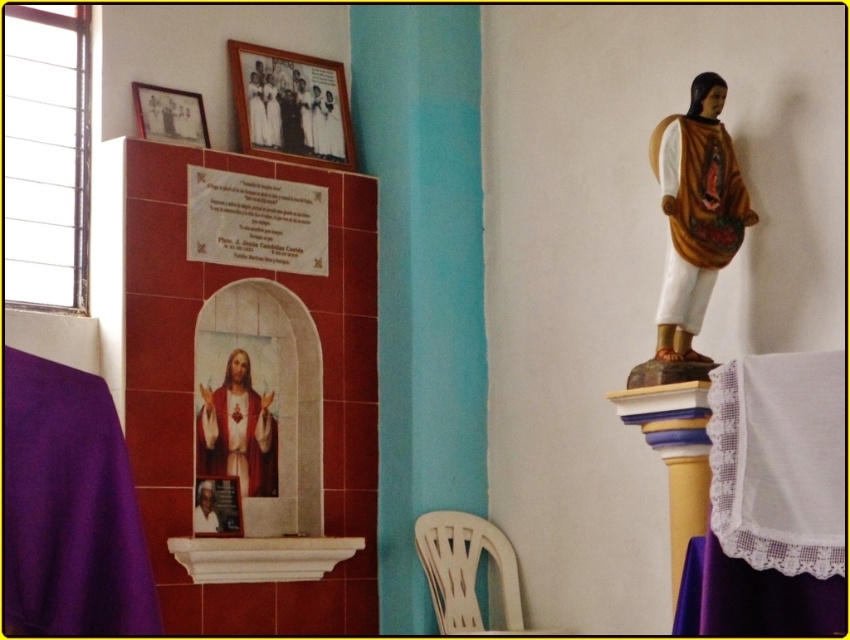
You are an interior designer planning to install a new light fixture in this space. You need to decide whether the matte brown statue at upper right and the matte black photo frame at upper center will block the light from reaching the center area. Based on their positions, can you determine which object is closer to the front and might cast a larger shadow?

The matte brown statue at upper right is in front of the matte black photo frame at upper center, so it is closer to the front and would cast a larger shadow over the center area.

You are an interior designer planning to add a new decorative element to this religious space. You have a small golden ornament that is 10 cm in height. You want to place it near the smooth white statue at upper right and the white matte robe at upper center. Considering their sizes, which object should you place it closer to if you want the ornament to appear proportionally balanced?

The smooth white statue at upper right has a smaller size compared to the white matte robe at upper center. To achieve proportional balance, the small golden ornament of 10 cm should be placed closer to the smooth white statue at upper right since it is smaller in size, ensuring visual harmony between the ornament and the statue.